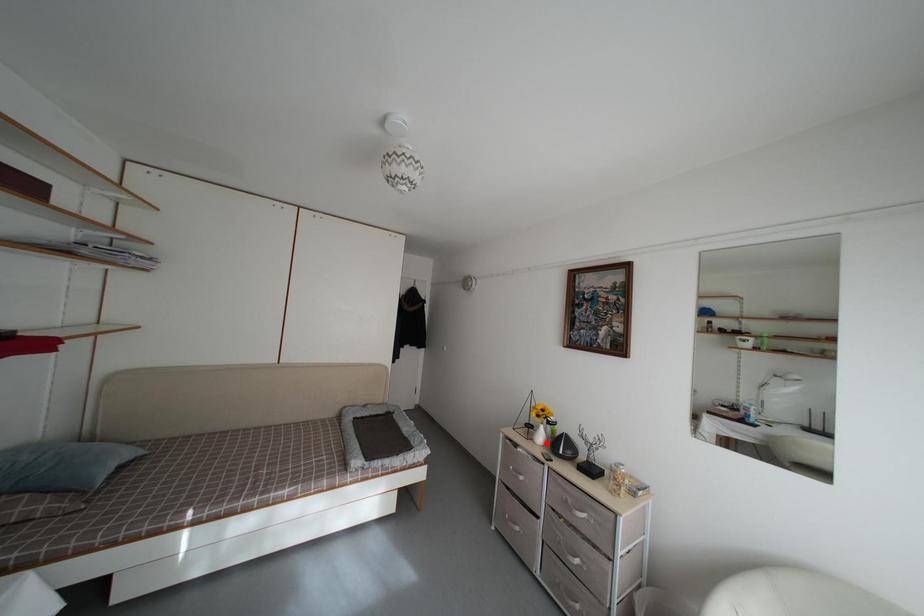
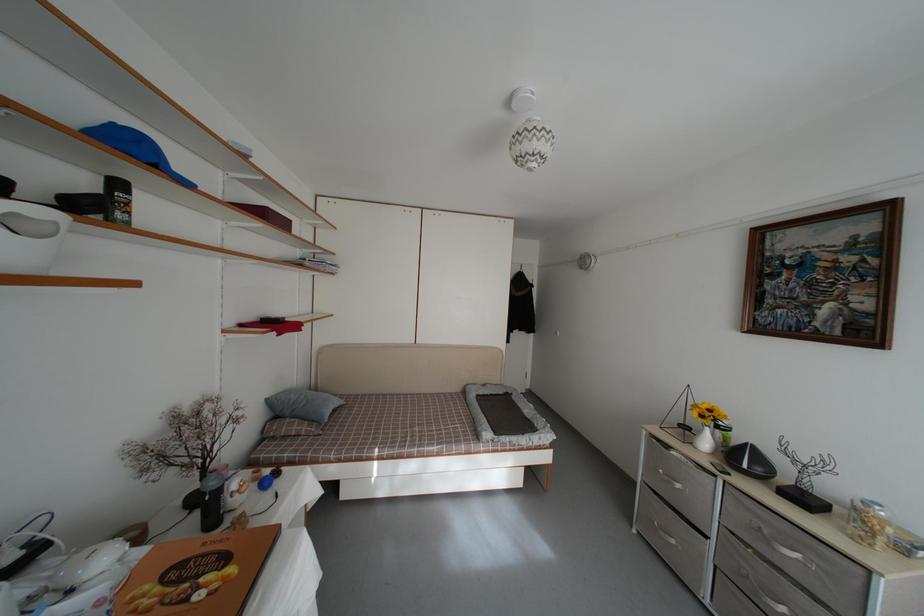
Question: I am providing you with two images of the same scene from different viewpoints. A red point is shown in image1. For the corresponding object point in image2, is it positioned nearer or farther from the camera?

Choices:
 (A) Nearer
 (B) Farther

Answer: (A)